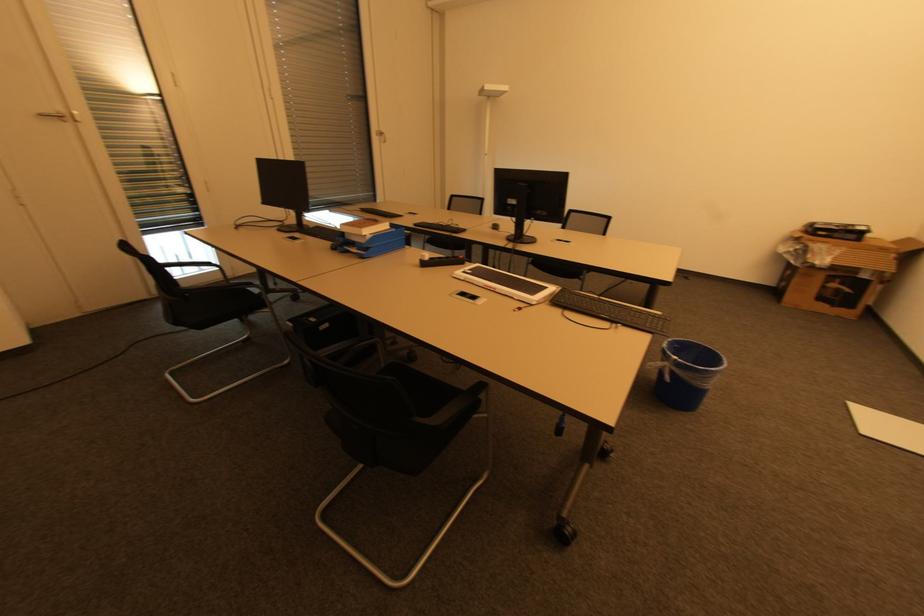
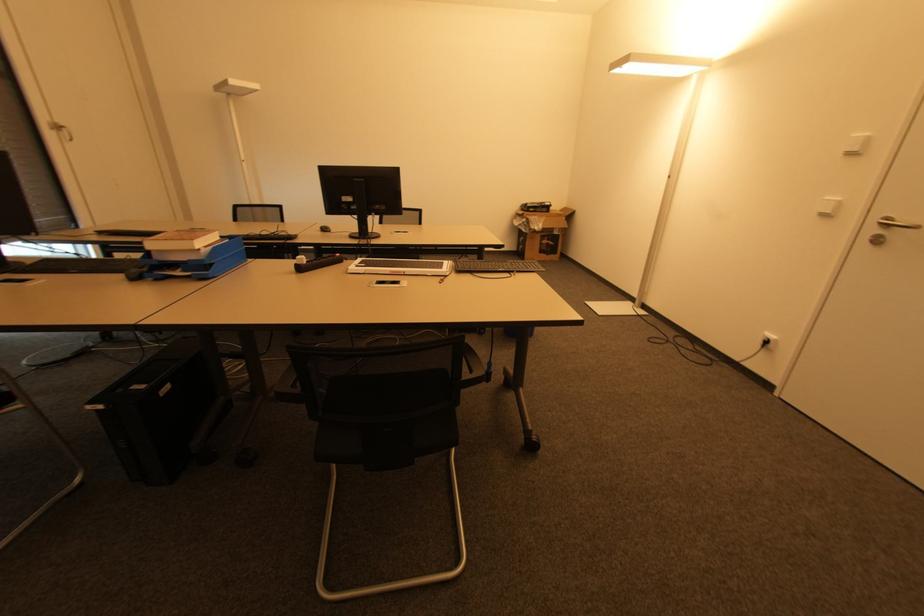
Locate, in the second image, the point that corresponds to the point at 840,290 in the first image.

(550, 245)